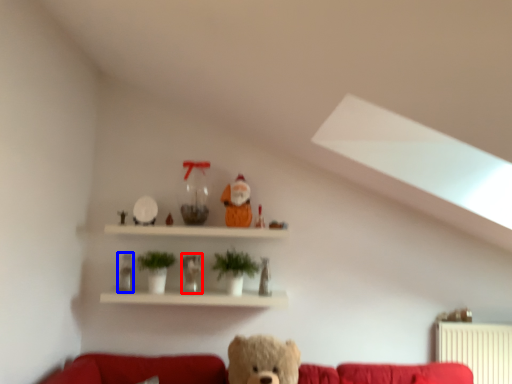
Question: Which of the following is the closest to the observer, figurine (highlighted by a red box) or toy (highlighted by a blue box)?

Choices:
 (A) figurine
 (B) toy

Answer: (A)